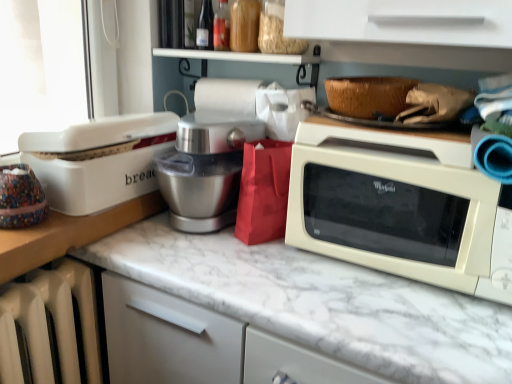
At what (x,y) coordinates should I click in order to perform the action: click on vacant area to the left of white glossy microwave at right. Please return your answer as a coordinate pair (x, y). Looking at the image, I should click on (256, 276).